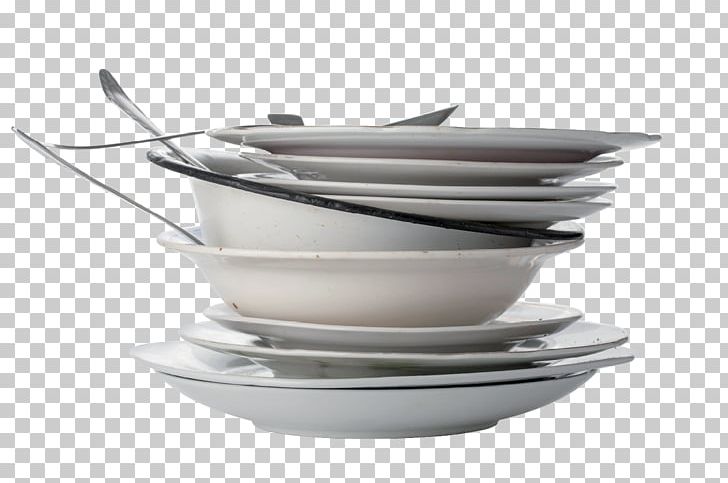
Locate an element on the screen. bowlsplates is located at coordinates (346, 377), (347, 360), (347, 338), (405, 201), (410, 189), (415, 176), (416, 145).